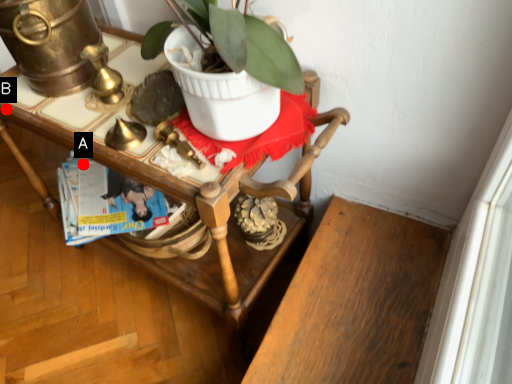
Question: Two points are circled on the image, labeled by A and B beside each circle. Which of the following is the closest to the observer?

Choices:
 (A) A is closer
 (B) B is closer

Answer: (B)